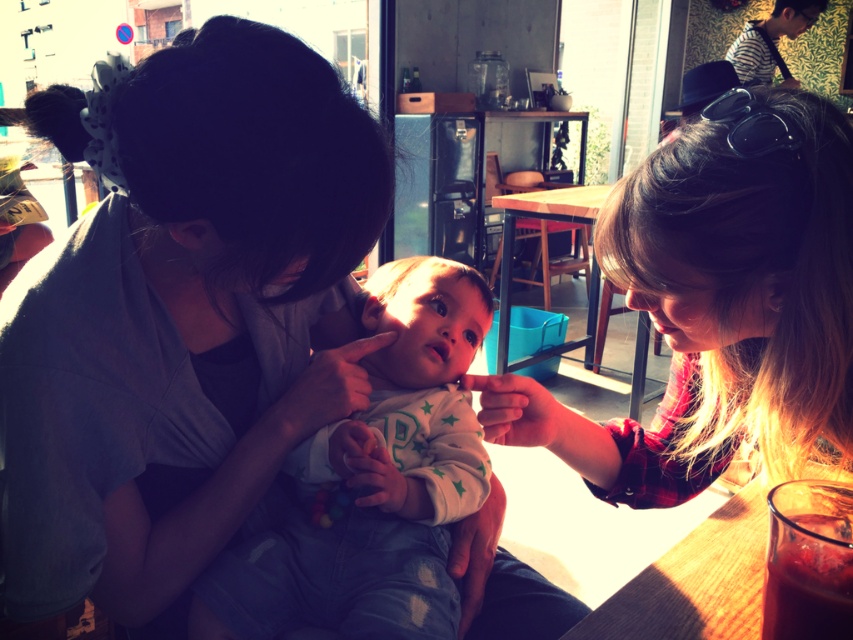
Locate an element on the screen. matte gray shirt at center is located at coordinates (184, 326).

Consider the image. Does matte gray shirt at center appear on the right side of white soft fabric baby at center?

Incorrect, matte gray shirt at center is not on the right side of white soft fabric baby at center.

Is point (280, 90) closer to viewer compared to point (440, 294)?

Yes, point (280, 90) is closer to viewer.

I want to click on matte gray shirt at center, so click(184, 326).

Can you confirm if plaid shirt at right is taller than wooden table at lower right?

Indeed, plaid shirt at right has a greater height compared to wooden table at lower right.

Where is `plaid shirt at right`? The width and height of the screenshot is (853, 640). plaid shirt at right is located at coordinates (718, 308).

Between white soft fabric baby at center and wooden table at lower right, which one has less height?

Standing shorter between the two is wooden table at lower right.

In the scene shown: Measure the distance between point (405, 324) and camera.

Point (405, 324) is 34.60 inches from camera.

Does point (474, 452) come behind point (733, 557)?

Yes, point (474, 452) is farther from viewer.

The width and height of the screenshot is (853, 640). In order to click on white soft fabric baby at center in this screenshot , I will do `click(376, 483)`.